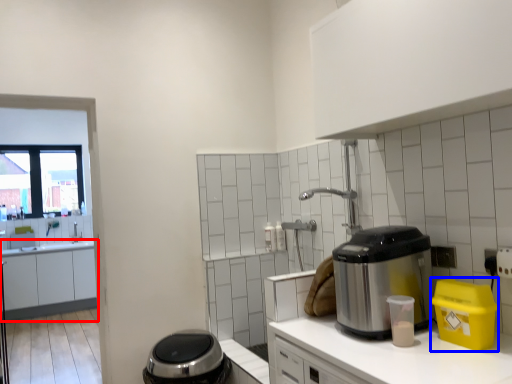
Question: Among these objects, which one is farthest to the camera, cabinetry (highlighted by a red box) or appliance (highlighted by a blue box)?

Choices:
 (A) cabinetry
 (B) appliance

Answer: (A)